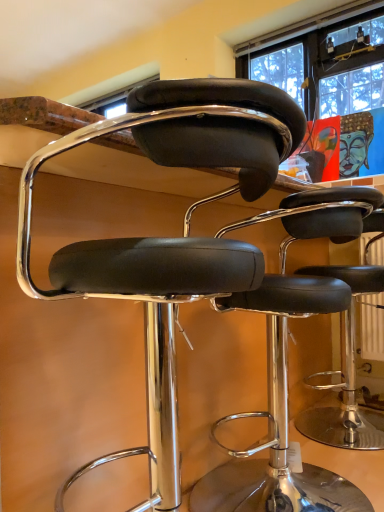
Describe the element at coordinates (287, 369) in the screenshot. I see `black leather stool at center, marked as the second chair in a front-to-back arrangement` at that location.

Identify the location of black leather stool at center, marked as the second chair in a front-to-back arrangement. Image resolution: width=384 pixels, height=512 pixels. (287, 369).

This screenshot has height=512, width=384. What are the coordinates of `black leather stool at center, the second chair from the back` in the screenshot? It's located at (171, 238).

What do you see at coordinates (171, 238) in the screenshot? This screenshot has width=384, height=512. I see `black leather stool at center, the first chair from the front` at bounding box center [171, 238].

This screenshot has width=384, height=512. Identify the location of black leather stool at center, marked as the second chair in a front-to-back arrangement. (287, 369).

Consider the image. Would you say black leather stool at center, the second chair from the back, is to the left or to the right of black leather stool at center, which appears as the 1th chair when viewed from the back, in the picture?

black leather stool at center, the second chair from the back, is positioned on black leather stool at center, which appears as the 1th chair when viewed from the back,'s left side.

Is black leather stool at center, the first chair from the front, behind black leather stool at center, which appears as the 1th chair when viewed from the back?

No, it is not.

Is point (162, 492) closer or farther from the camera than point (334, 281)?

Point (162, 492).

Consider the image. From the image's perspective, relative to black leather stool at center, which appears as the 1th chair when viewed from the back, is black leather stool at center, the first chair from the front, above or below?

black leather stool at center, the first chair from the front, is situated higher than black leather stool at center, which appears as the 1th chair when viewed from the back, in the image.

From a real-world perspective, is black leather stool at center, the first chair from the front, physically above black leather stool at center, which appears as the 1th chair when viewed from the back?

Yes, from a real-world perspective, black leather stool at center, the first chair from the front, is on top of black leather stool at center, which appears as the 1th chair when viewed from the back.

Between black leather stool at center, the first chair from the front, and black leather stool at center, marked as the second chair in a front-to-back arrangement, which one has smaller width?

black leather stool at center, marked as the second chair in a front-to-back arrangement.

Considering the sizes of objects black leather stool at center, the second chair from the back, and black leather stool at center, marked as the second chair in a front-to-back arrangement, in the image provided, who is shorter, black leather stool at center, the second chair from the back, or black leather stool at center, marked as the second chair in a front-to-back arrangement,?

black leather stool at center, marked as the second chair in a front-to-back arrangement, is shorter.

Can you confirm if black leather stool at center, the second chair from the back, is bigger than black leather stool at center, which appears as the 1th chair when viewed from the back?

Yes, black leather stool at center, the second chair from the back, is bigger than black leather stool at center, which appears as the 1th chair when viewed from the back.

Could black leather stool at center, which appears as the 1th chair when viewed from the back, be considered to be inside black leather stool at center, the second chair from the back?

Yes, black leather stool at center, which appears as the 1th chair when viewed from the back, is inside black leather stool at center, the second chair from the back.

Is black leather stool at center, the second chair from the back, not close to black leather stool at center, marked as the second chair in a front-to-back arrangement?

They are positioned close to each other.

Is black leather stool at center, the first chair from the front, facing away from black leather stool at center, which appears as the 1th chair when viewed from the back?

Yes, black leather stool at center, the first chair from the front, is positioned with its back facing black leather stool at center, which appears as the 1th chair when viewed from the back.

How distant is black leather stool at center, the first chair from the front, from black leather stool at center, marked as the second chair in a front-to-back arrangement?

black leather stool at center, the first chair from the front, is 24.42 inches from black leather stool at center, marked as the second chair in a front-to-back arrangement.

The image size is (384, 512). I want to click on chair on the left of black leather stool at center, which appears as the 1th chair when viewed from the back, so click(x=171, y=238).

Is black leather stool at center, marked as the second chair in a front-to-back arrangement, at the right side of black leather stool at center, the first chair from the front?

Correct, you'll find black leather stool at center, marked as the second chair in a front-to-back arrangement, to the right of black leather stool at center, the first chair from the front.

Who is more distant, black leather stool at center, which appears as the 1th chair when viewed from the back, or black leather stool at center, the first chair from the front?

black leather stool at center, which appears as the 1th chair when viewed from the back.

Which point is more forward, [284,407] or [100,294]?

The point [100,294] is closer.

From the image's perspective, would you say black leather stool at center, which appears as the 1th chair when viewed from the back, is shown under black leather stool at center, the second chair from the back?

Yes, from the image's perspective, black leather stool at center, which appears as the 1th chair when viewed from the back, is beneath black leather stool at center, the second chair from the back.

From a real-world perspective, which is physically above, black leather stool at center, marked as the second chair in a front-to-back arrangement, or black leather stool at center, the first chair from the front?

black leather stool at center, the first chair from the front, is physically above.

Considering the sizes of objects black leather stool at center, which appears as the 1th chair when viewed from the back, and black leather stool at center, the second chair from the back, in the image provided, who is wider, black leather stool at center, which appears as the 1th chair when viewed from the back, or black leather stool at center, the second chair from the back,?

With larger width is black leather stool at center, the second chair from the back.

Between black leather stool at center, marked as the second chair in a front-to-back arrangement, and black leather stool at center, the first chair from the front, which one has less height?

black leather stool at center, marked as the second chair in a front-to-back arrangement.

Is black leather stool at center, marked as the second chair in a front-to-back arrangement, bigger or smaller than black leather stool at center, the first chair from the front?

Considering their sizes, black leather stool at center, marked as the second chair in a front-to-back arrangement, takes up less space than black leather stool at center, the first chair from the front.

Is black leather stool at center, which appears as the 1th chair when viewed from the back, situated inside black leather stool at center, the first chair from the front, or outside?

black leather stool at center, which appears as the 1th chair when viewed from the back, exists entirely within black leather stool at center, the first chair from the front.

Is black leather stool at center, which appears as the 1th chair when viewed from the back, placed right next to black leather stool at center, the second chair from the back?

They are not placed beside each other.

Could you tell me if black leather stool at center, which appears as the 1th chair when viewed from the back, is facing black leather stool at center, the first chair from the front?

Answer: Yes, black leather stool at center, which appears as the 1th chair when viewed from the back, is aimed at black leather stool at center, the first chair from the front.

Based on the photo, how distant is black leather stool at center, which appears as the 1th chair when viewed from the back, from black leather stool at center, the second chair from the back?

A distance of 24.42 inches exists between black leather stool at center, which appears as the 1th chair when viewed from the back, and black leather stool at center, the second chair from the back.

Locate an element on the screen. chair below the black leather stool at center, the second chair from the back (from the image's perspective) is located at coordinates (287, 369).

At what (x,y) coordinates should I click in order to perform the action: click on chair that appears above the black leather stool at center, which appears as the 1th chair when viewed from the back (from the image's perspective). Please return your answer as a coordinate pair (x, y). The image size is (384, 512). Looking at the image, I should click on (171, 238).

Locate an element on the screen. chair that appears on the right of black leather stool at center, the first chair from the front is located at coordinates (287, 369).